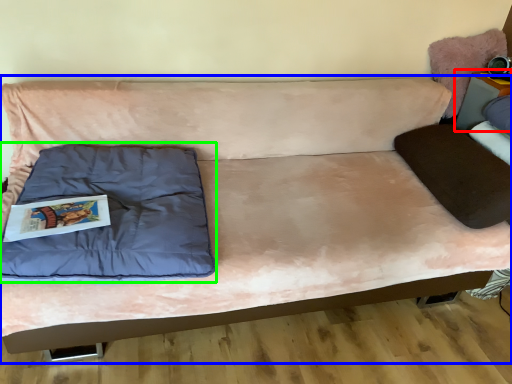
Question: Considering the real-world distances, which object is closest to table (highlighted by a red box)? studio couch (highlighted by a blue box) or pillow (highlighted by a green box).

Choices:
 (A) studio couch
 (B) pillow

Answer: (A)